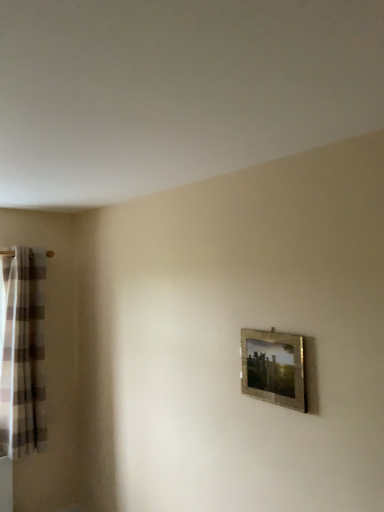
Question: From a real-world perspective, is gold textured frame at center right above or below plaid fabric curtain at left?

Choices:
 (A) below
 (B) above

Answer: (B)

Question: Do you think gold textured frame at center right is within plaid fabric curtain at left, or outside of it?

Choices:
 (A) inside
 (B) outside

Answer: (B)

Question: Is gold textured frame at center right bigger or smaller than plaid fabric curtain at left?

Choices:
 (A) big
 (B) small

Answer: (B)

Question: Is plaid fabric curtain at left to the left or to the right of gold textured frame at center right in the image?

Choices:
 (A) right
 (B) left

Answer: (B)

Question: Is plaid fabric curtain at left taller or shorter than gold textured frame at center right?

Choices:
 (A) tall
 (B) short

Answer: (A)

Question: Is point 39,252 closer or farther from the camera than point 279,388?

Choices:
 (A) closer
 (B) farther

Answer: (B)

Question: Considering their positions, is plaid fabric curtain at left located in front of or behind gold textured frame at center right?

Choices:
 (A) front
 (B) behind

Answer: (B)